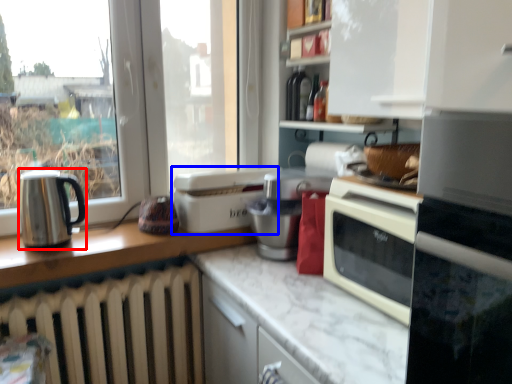
Question: Among these objects, which one is nearest to the camera, kitchen appliance (highlighted by a red box) or kitchen appliance (highlighted by a blue box)?

Choices:
 (A) kitchen appliance
 (B) kitchen appliance

Answer: (A)